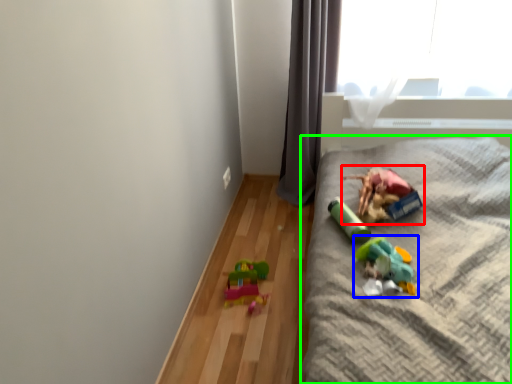
Question: Considering the real-world distances, which object is farthest from toy (highlighted by a red box)? toy (highlighted by a blue box) or furniture (highlighted by a green box)?

Choices:
 (A) toy
 (B) furniture

Answer: (A)